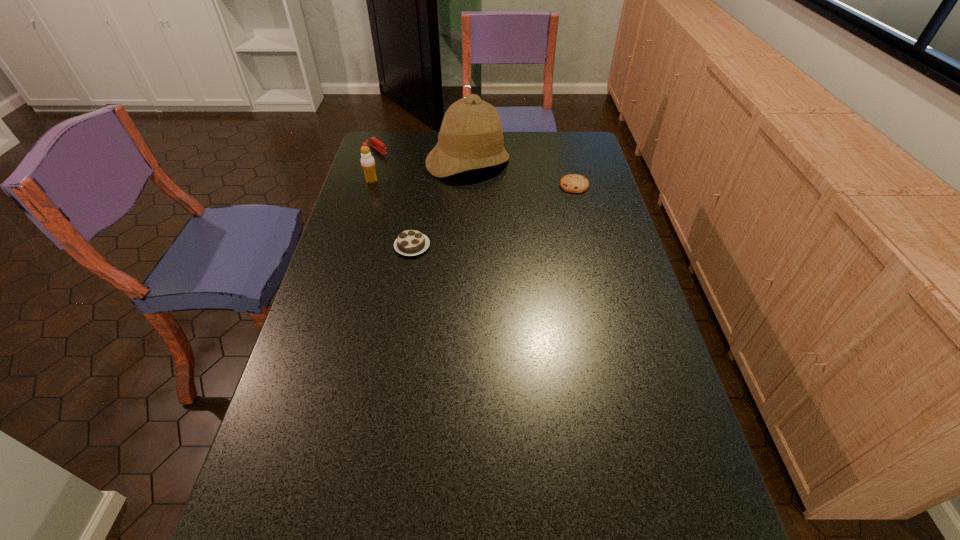
I want to click on vacant space located 0.190m on the front-facing side of the stapler, so click(411, 174).

Locate an element on the screen. vacant space located 0.350m on the front-facing side of the tallest object is located at coordinates (511, 241).

This screenshot has width=960, height=540. I want to click on blank space located 0.210m on the front-facing side of the tallest object, so click(x=497, y=215).

Find the location of a particular element. The image size is (960, 540). vacant space situated 0.350m on the front-facing side of the tallest object is located at coordinates (511, 241).

The width and height of the screenshot is (960, 540). I want to click on free space located at the front with a straw on the icecream, so click(388, 186).

I want to click on vacant space located at the front with a straw on the icecream, so click(399, 190).

You are a GUI agent. You are given a task and a screenshot of the screen. Output one action in this format:
    pyautogui.click(x=<x>, y=<y>)
    Task: Click on the vacant space situated 0.060m at the front with a straw on the icecream
    The width and height of the screenshot is (960, 540).
    Given the screenshot: What is the action you would take?
    pyautogui.click(x=391, y=187)

Locate an element on the screen. Image resolution: width=960 pixels, height=540 pixels. stapler present at the far edge is located at coordinates tap(373, 141).

Locate an element on the screen. The width and height of the screenshot is (960, 540). hat at the far edge is located at coordinates (471, 137).

This screenshot has height=540, width=960. Find the location of `stapler that is at the left edge`. stapler that is at the left edge is located at coordinates (373, 141).